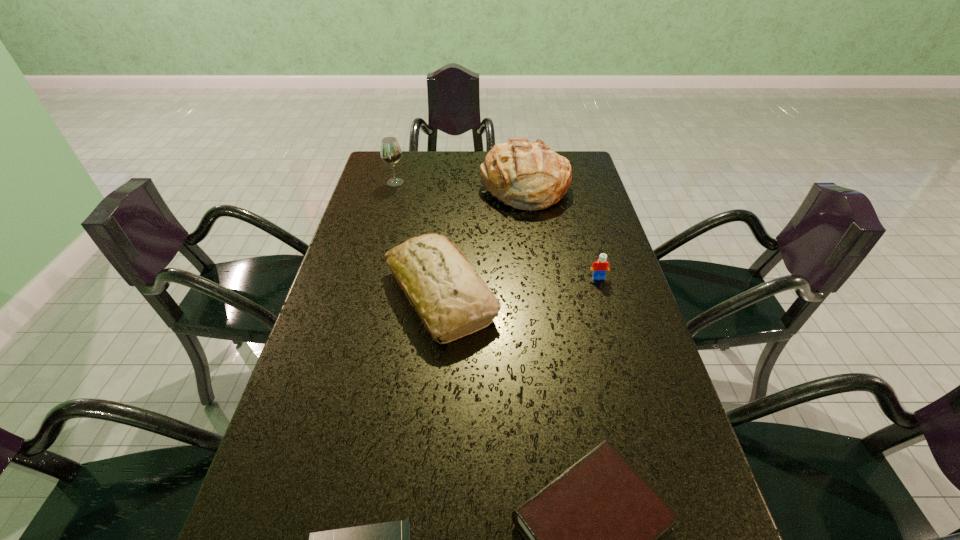
Where is `free area in between the farther bread and the third shortest object`? Image resolution: width=960 pixels, height=540 pixels. free area in between the farther bread and the third shortest object is located at coordinates (562, 233).

Locate an element on the screen. Image resolution: width=960 pixels, height=540 pixels. empty location between the wineglass and the Lego is located at coordinates (496, 230).

At what (x,y) coordinates should I click in order to perform the action: click on the closest object to the fifth tallest object. Please return your answer as a coordinate pair (x, y). Looking at the image, I should click on (391, 539).

Select which object appears as the fifth closest to the wineglass. Please provide its 2D coordinates. Your answer should be formatted as a tuple, i.e. [(x, y)], where the tuple contains the x and y coordinates of a point satisfying the conditions above.

[(391, 539)]